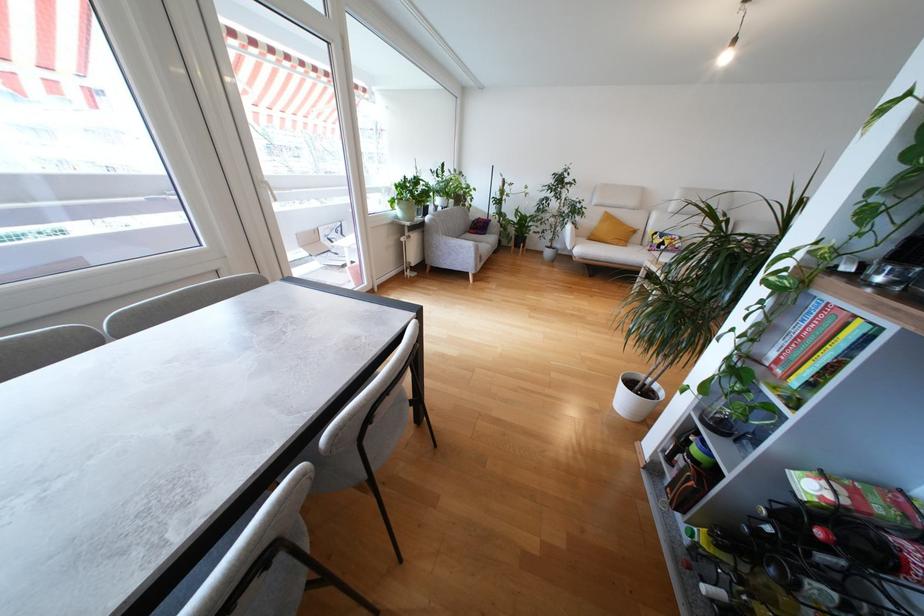
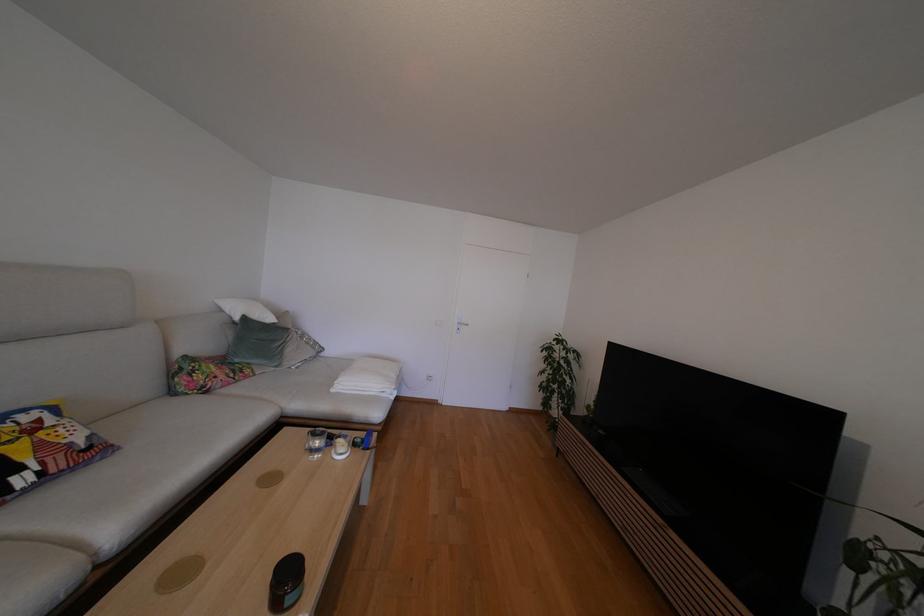
Find the pixel in the second image that matches pixel 675 237 in the first image.

(6, 419)